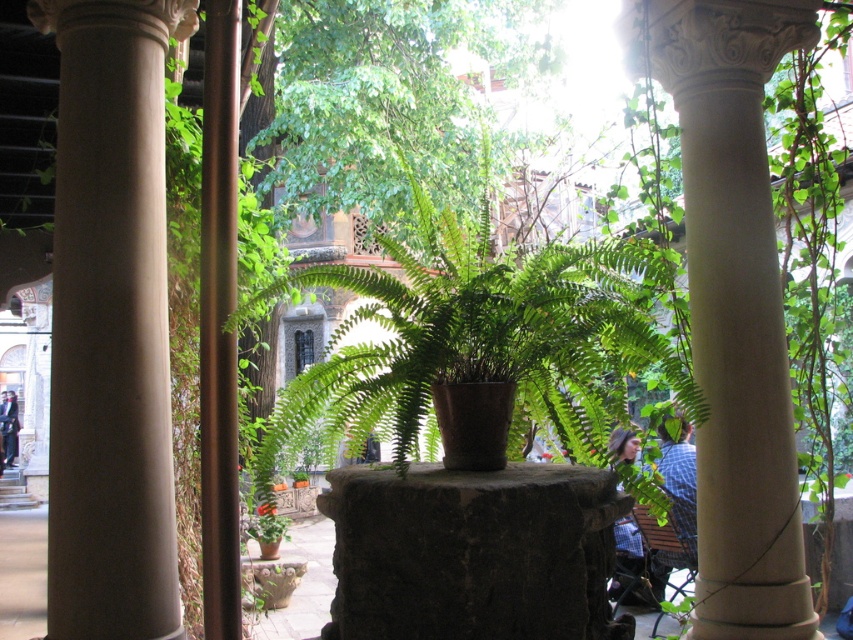
Does smooth beige column at left appear over white stone column at center?

Indeed, smooth beige column at left is positioned over white stone column at center.

You are a GUI agent. You are given a task and a screenshot of the screen. Output one action in this format:
    pyautogui.click(x=<x>, y=<y>)
    Task: Click on the smooth beige column at left
    The image size is (853, 640).
    Given the screenshot: What is the action you would take?
    pyautogui.click(x=109, y=323)